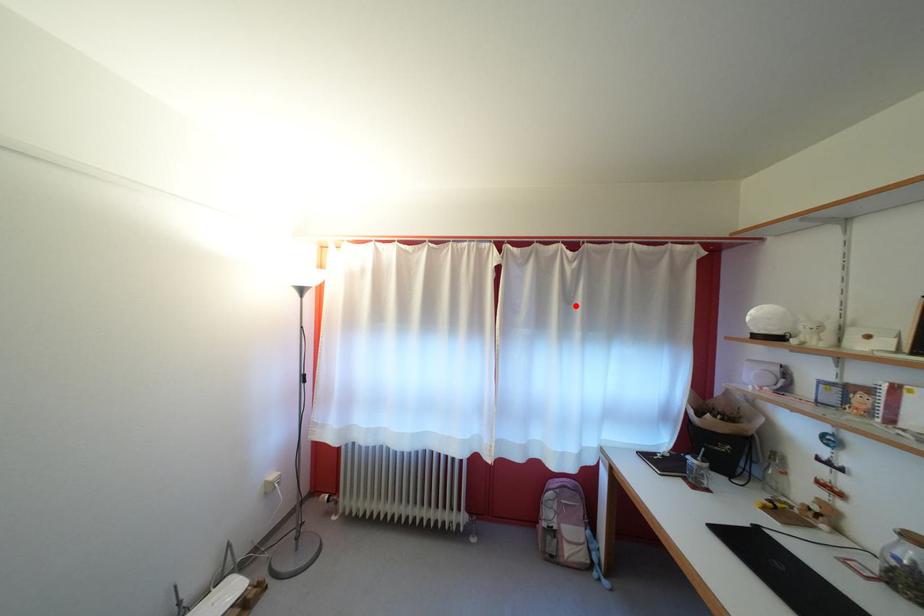
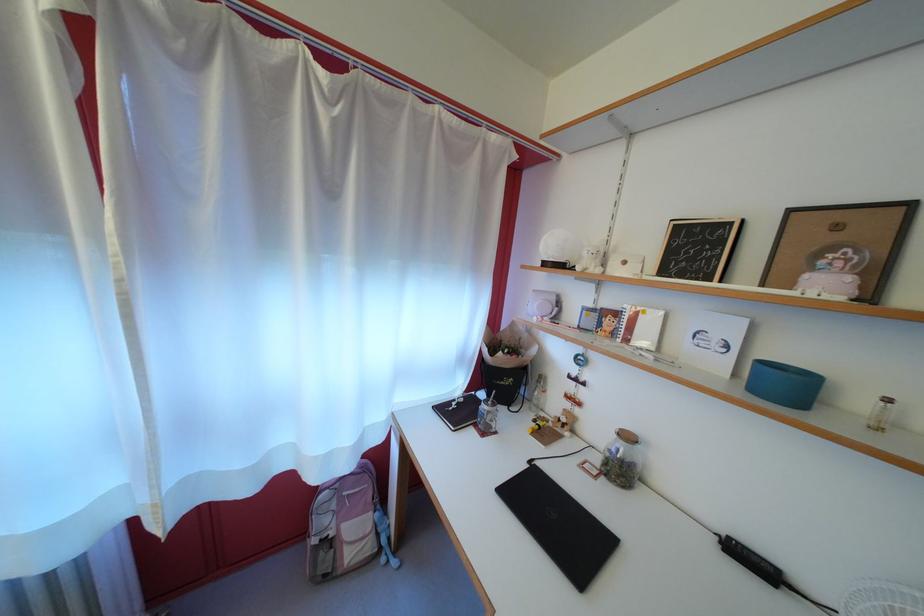
Locate, in the second image, the point that corresponds to the highlighted location in the first image.

(335, 193)